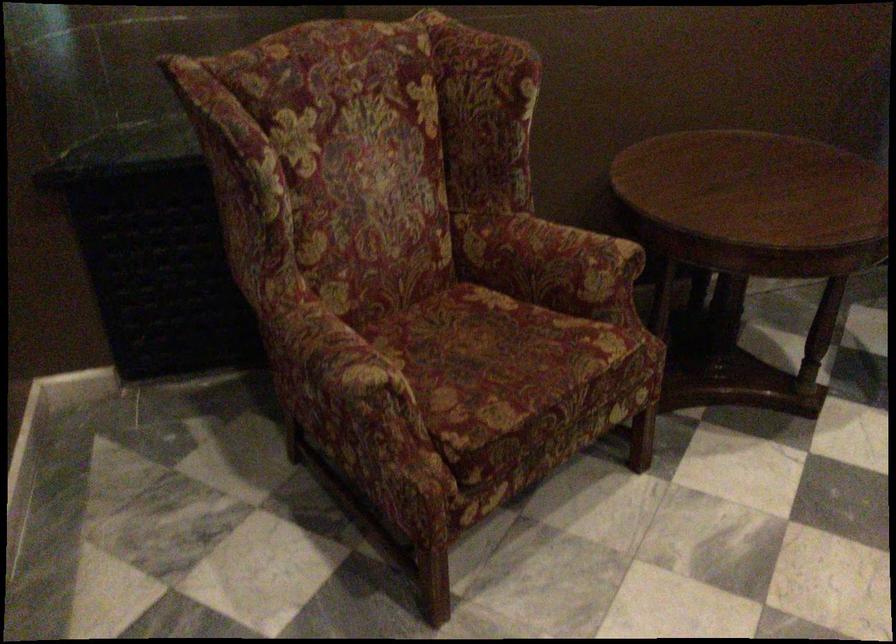
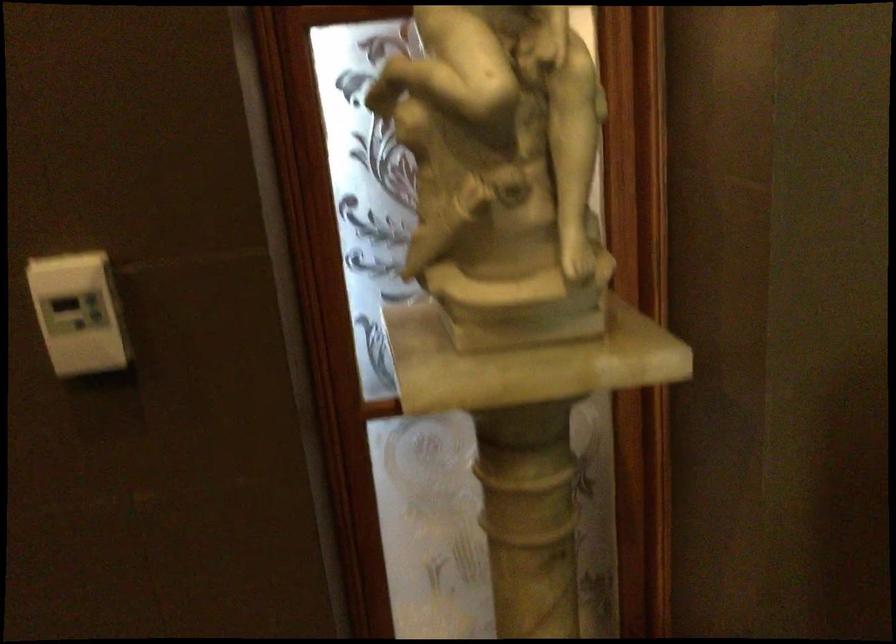
First-person continuous shooting, in which direction is the camera rotating?

The camera rotated toward left-down.